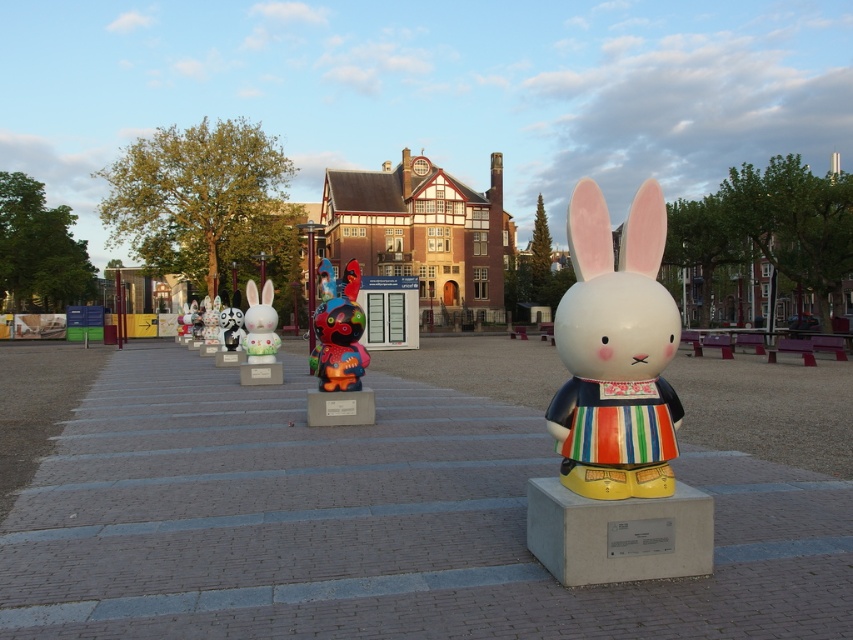
You are standing in the plaza and see the large rabbit sculpture dressed in a striped apron and yellow boots. There is a point marked at coordinates (614, 353). Which object is this point located on?

The point at coordinates (614, 353) is located on the matte ceramic rabbit at center.

You are an art curator planning to photograph the matte ceramic rabbit at center and the white glossy rabbit at center together in a single frame. Based on their positions, which rabbit should you place on the left side of the photo to ensure both are captured properly?

The white glossy rabbit at center should be placed on the left side of the photo because the matte ceramic rabbit at center is positioned to its right in the original display.